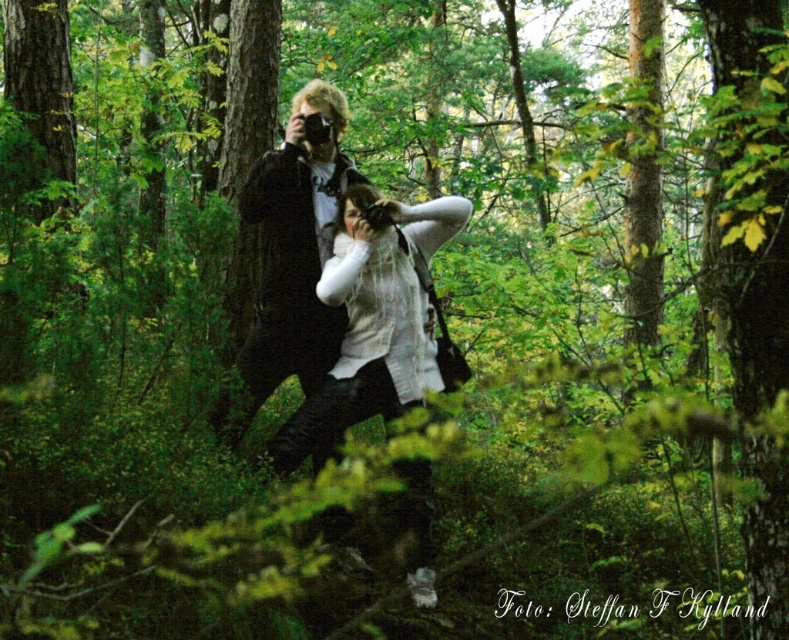
You are a photographer trying to capture the two individuals in the forest. The scene requires that the white knitted sweater at center and the matte black jacket at center must be visible in the frame. Based on their positions, which clothing item will appear closer to the bottom of the photo?

The white knitted sweater at center is below matte black jacket at center, so it will appear closer to the bottom of the photo.

You are a fashion designer observing two people in a forest scene. You notice the white knitted sweater at center and the matte black jacket at center. Which clothing item has a bigger size?

The white knitted sweater at center has a larger size compared to the matte black jacket at center.